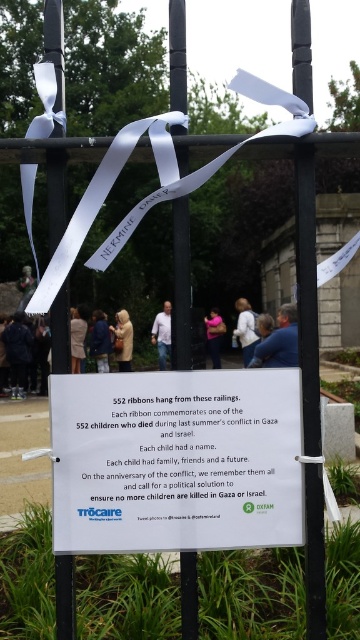
Which is behind, point (317, 595) or point (165, 339)?

The point (165, 339) is behind.

Is white matte pole at upper center further to the viewer compared to white cotton shirt at center?

No, white matte pole at upper center is in front of white cotton shirt at center.

This screenshot has width=360, height=640. What do you see at coordinates (307, 294) in the screenshot?
I see `white matte pole at upper center` at bounding box center [307, 294].

Identify the location of white matte pole at upper center. (307, 294).

Can you confirm if white matte pole at left is wider than white fabric at center?

In fact, white matte pole at left might be narrower than white fabric at center.

Based on the photo, is white matte pole at left thinner than white fabric at center?

Correct, white matte pole at left's width is less than white fabric at center's.

Which is behind, point (59, 227) or point (254, 337)?

Positioned behind is point (254, 337).

Where is `white matte pole at left`? The image size is (360, 640). white matte pole at left is located at coordinates (56, 193).

Is light brown coat at center taller than white cotton shirt at center?

No, light brown coat at center is not taller than white cotton shirt at center.

Who is more forward, (77,358) or (168,316)?

Point (77,358) is in front.

At what (x,y) coordinates should I click in order to perform the action: click on light brown coat at center. Please return your answer as a coordinate pair (x, y). This screenshot has width=360, height=640. Looking at the image, I should click on (78, 337).

This screenshot has height=640, width=360. In order to click on light brown coat at center in this screenshot , I will do `click(78, 337)`.